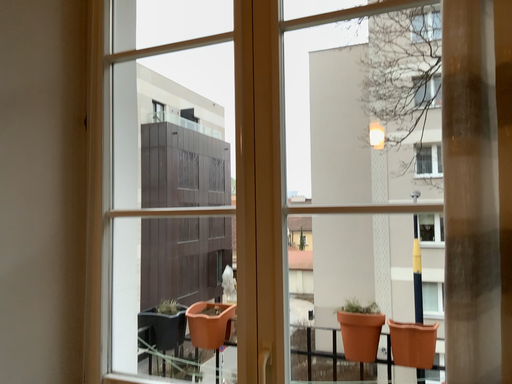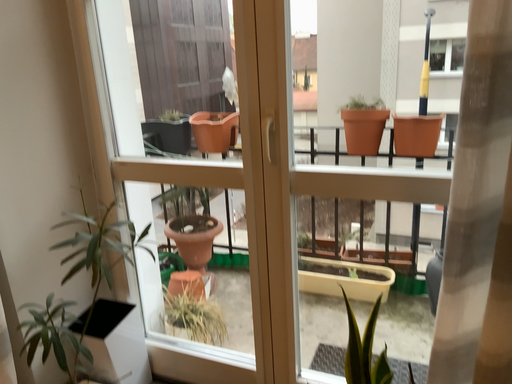
Question: How did the camera likely rotate when shooting the video?

Choices:
 (A) rotated downward
 (B) rotated upward

Answer: (A)